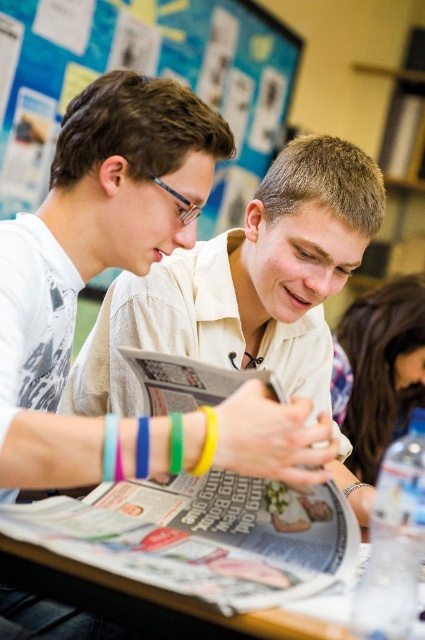
Question: Can you confirm if white matte shirt at center is wider than brown leather wallet at lower right?

Choices:
 (A) yes
 (B) no

Answer: (A)

Question: Does blue paperboard at upper center appear over wooden table at lower center?

Choices:
 (A) yes
 (B) no

Answer: (A)

Question: Does blue paperboard at upper center appear on the left side of brown leather wallet at lower right?

Choices:
 (A) no
 (B) yes

Answer: (B)

Question: Which is nearer to the brown leather wallet at lower right?

Choices:
 (A) wooden table at lower center
 (B) white matte shirt at center

Answer: (B)

Question: Which of the following is the farthest from the observer?

Choices:
 (A) (336, 596)
 (B) (391, 355)
 (C) (328, 273)
 (D) (163, 13)

Answer: (D)

Question: Considering the real-world distances, which object is closest to the blue paperboard at upper center?

Choices:
 (A) white matte shirt at center
 (B) brown leather wallet at lower right
 (C) wooden table at lower center

Answer: (B)